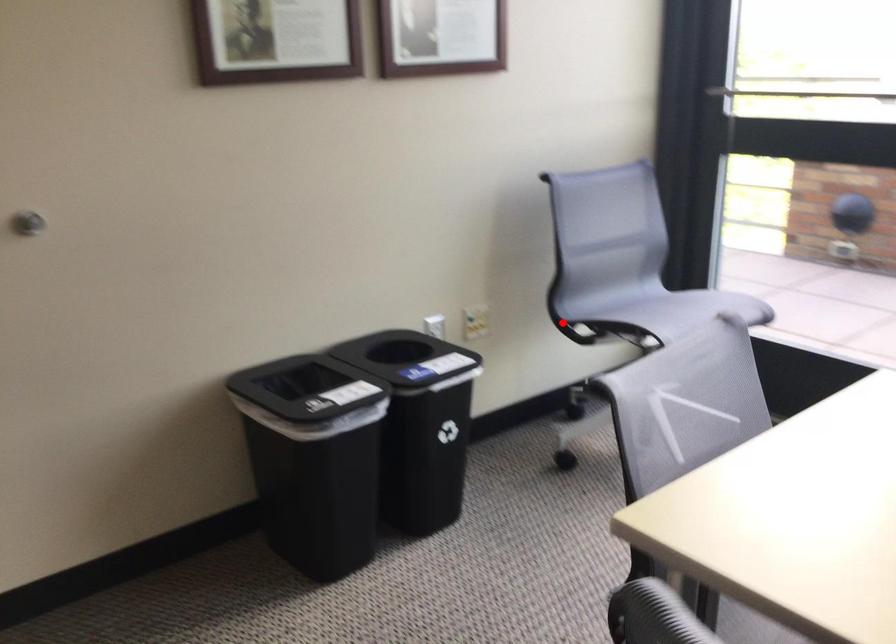
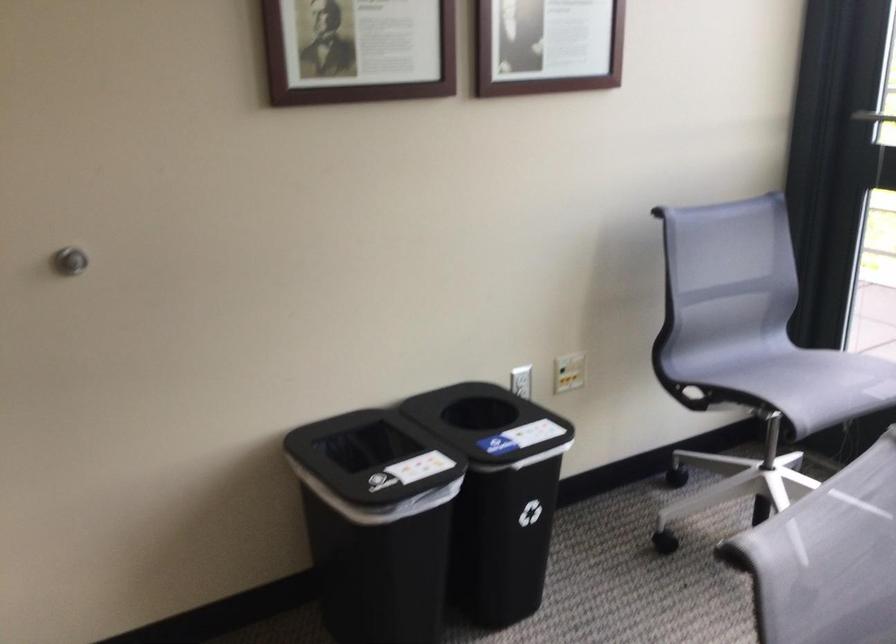
Question: A red point is marked in image1. In image2, is the corresponding 3D point closer to the camera or farther? Reply with the corresponding letter.

Choices:
 (A) The corresponding 3D point is closer.
 (B) The corresponding 3D point is farther.

Answer: (A)